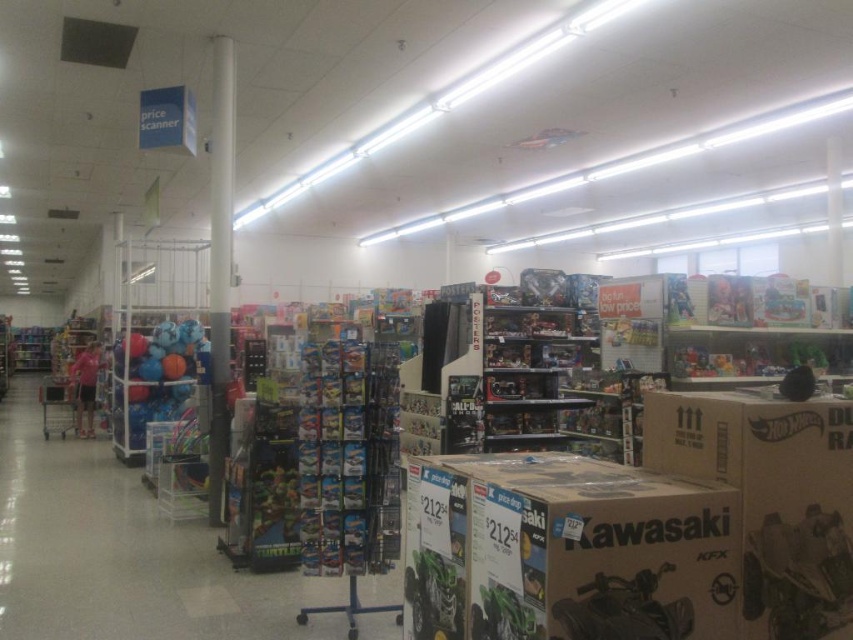
Question: Does white glossy pillar at center have a lesser width compared to matte blue basketball at left?

Choices:
 (A) no
 (B) yes

Answer: (B)

Question: Which of the following is the farthest from the observer?

Choices:
 (A) (97, 563)
 (B) (224, 352)
 (C) (753, 444)
 (D) (79, 388)

Answer: (D)

Question: Among these points, which one is nearest to the camera?

Choices:
 (A) (846, 525)
 (B) (74, 378)

Answer: (A)

Question: Does white cardboard hot wheels box at right appear on the left side of matte blue basketball at left?

Choices:
 (A) yes
 (B) no

Answer: (B)

Question: Does white glossy pillar at center have a smaller size compared to matte blue basketball at left?

Choices:
 (A) yes
 (B) no

Answer: (A)

Question: Which point is closer to the camera?

Choices:
 (A) (216, 461)
 (B) (758, 554)
 (C) (167, 320)
 (D) (202, 596)

Answer: (B)